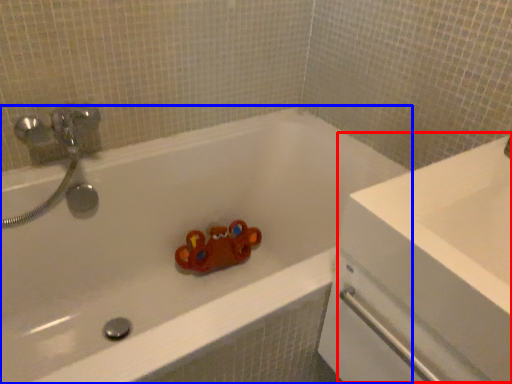
Question: Which of the following is the closest to the observer, counter top (highlighted by a red box) or bathtub (highlighted by a blue box)?

Choices:
 (A) counter top
 (B) bathtub

Answer: (A)